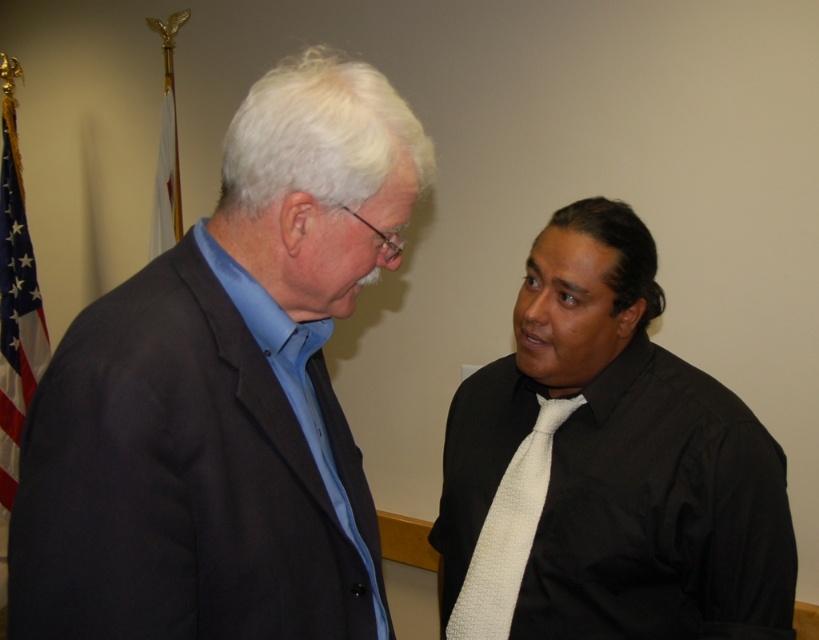
Question: Does white textured tie at center come behind blue smooth dress shirt at left?

Choices:
 (A) no
 (B) yes

Answer: (B)

Question: Which point is farther to the camera?

Choices:
 (A) (277, 346)
 (B) (501, 570)
 (C) (679, 472)

Answer: (B)

Question: Which object is the farthest from the american flag at left?

Choices:
 (A) blue smooth dress shirt at left
 (B) matte black suit at left
 (C) black satin shirt and tie at right
 (D) white fabric flag at upper left

Answer: (B)

Question: Observing the image, what is the correct spatial positioning of white textured tie at center in reference to american flag at left?

Choices:
 (A) right
 (B) left

Answer: (A)

Question: Among these objects, which one is farthest from the camera?

Choices:
 (A) american flag at left
 (B) black satin shirt and tie at right
 (C) white fabric flag at upper left

Answer: (A)

Question: Can you confirm if white textured tie at center is positioned to the right of blue smooth dress shirt at left?

Choices:
 (A) no
 (B) yes

Answer: (B)